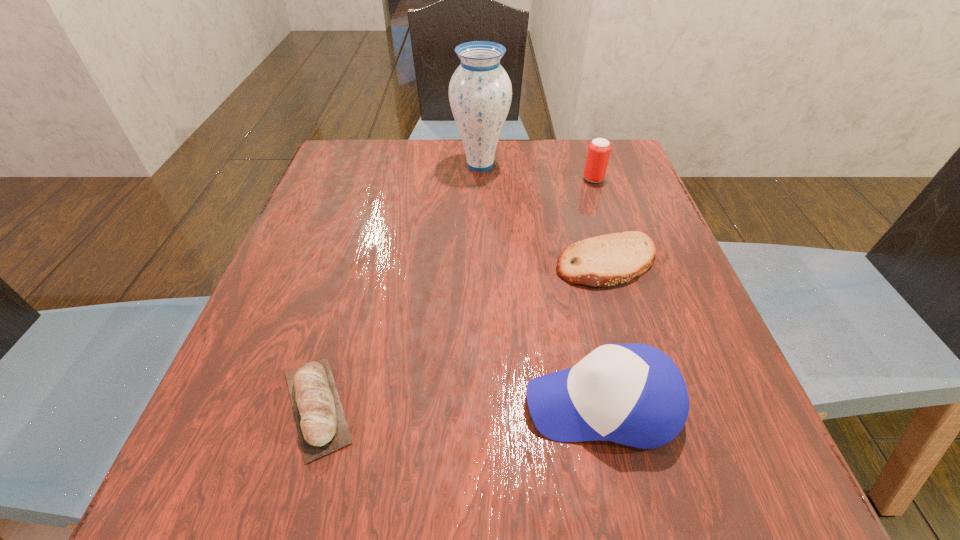
The image size is (960, 540). In order to click on free region located on the front-facing side of the baseball cap in this screenshot , I will do `click(348, 404)`.

The image size is (960, 540). I want to click on free space located on the front-facing side of the baseball cap, so click(422, 404).

At what (x,y) coordinates should I click in order to perform the action: click on vacant space located on the back of the nearer pita bread. Please return your answer as a coordinate pair (x, y). This screenshot has width=960, height=540. Looking at the image, I should click on (350, 289).

Locate an element on the screen. This screenshot has width=960, height=540. vacant space located 0.290m on the left of the third nearest object is located at coordinates (405, 262).

Where is `vase located in the far edge section of the desktop`? This screenshot has height=540, width=960. vase located in the far edge section of the desktop is located at coordinates click(480, 92).

Locate an element on the screen. beer can present at the far edge is located at coordinates (599, 149).

Where is `baseball cap at the near edge`? The image size is (960, 540). baseball cap at the near edge is located at coordinates (633, 394).

Identify the location of pita bread that is at the near edge. Image resolution: width=960 pixels, height=540 pixels. (322, 427).

Identify the location of object at the left edge. This screenshot has width=960, height=540. (322, 427).

Locate an element on the screen. Image resolution: width=960 pixels, height=540 pixels. beer can at the right edge is located at coordinates (599, 149).